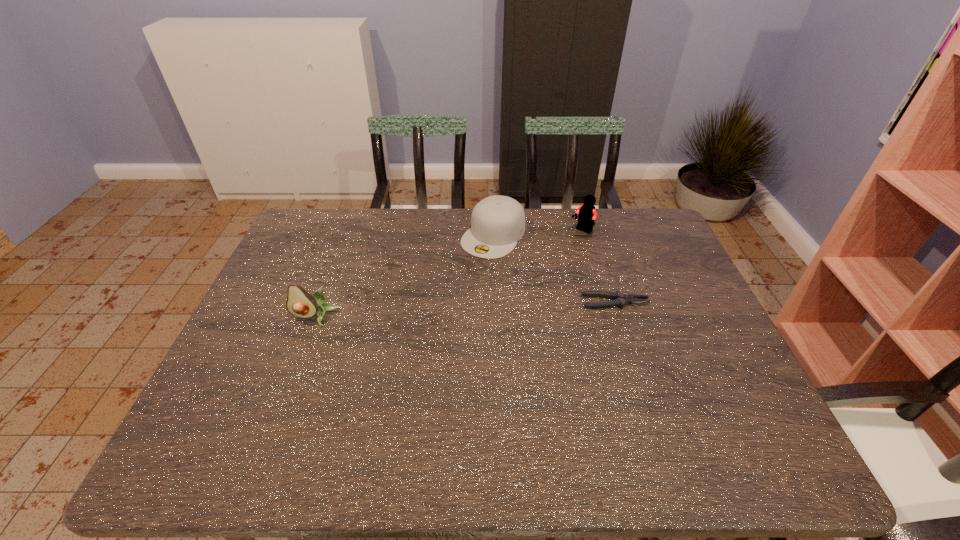
At what (x,y) coordinates should I click in order to perform the action: click on vacant space on the desktop that is between the leftmost object and the shortest object and is positioned on the front-facing side of the third tallest object. Please return your answer as a coordinate pair (x, y). Image resolution: width=960 pixels, height=540 pixels. Looking at the image, I should click on (433, 312).

This screenshot has height=540, width=960. In order to click on vacant space on the desktop that is between the leftmost object and the shortest object and is positioned on the front-facing side of the Lego in this screenshot , I will do click(488, 308).